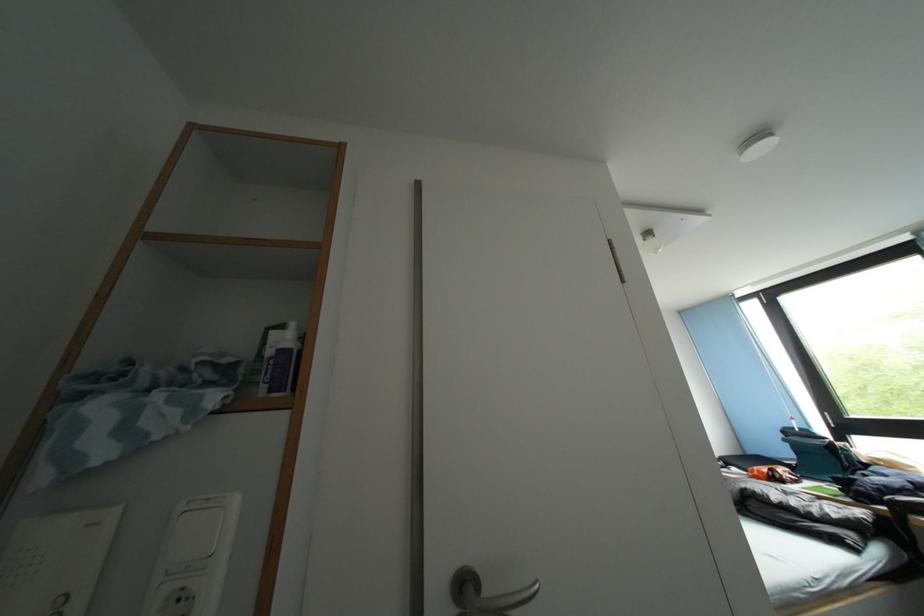
Find where to pull the metal door handle. Please return your answer as a coordinate pair (x, y).

(485, 594)